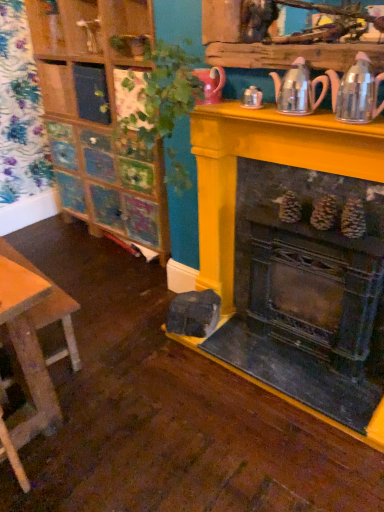
In order to click on shiny metallic teapot at upper right, acting as the 2th tea pot starting from the right in this screenshot , I will do `click(298, 89)`.

The width and height of the screenshot is (384, 512). What are the coordinates of `shiny metallic teapot at upper right, acting as the 2th tea pot starting from the right` in the screenshot? It's located at (298, 89).

Identify the location of tea pot in front of the rustic metal fireplace at center. Image resolution: width=384 pixels, height=512 pixels. pos(356,92).

Is rustic metal fireplace at center at the back of metallic silver tea pot at upper right, arranged as the first tea pot when viewed from the right?

No, metallic silver tea pot at upper right, arranged as the first tea pot when viewed from the right,'s orientation is not away from rustic metal fireplace at center.

Are metallic silver tea pot at upper right, arranged as the first tea pot when viewed from the right, and rustic metal fireplace at center beside each other?

metallic silver tea pot at upper right, arranged as the first tea pot when viewed from the right, and rustic metal fireplace at center are clearly separated.

Is metallic silver tea pot at upper right, which is the 2th tea pot in left-to-right order, taller than rustic metal fireplace at center?

In fact, metallic silver tea pot at upper right, which is the 2th tea pot in left-to-right order, may be shorter than rustic metal fireplace at center.

Looking at the image, does wooden stool at lower left seem bigger or smaller compared to shiny metallic teapot at upper right, acting as the 2th tea pot starting from the right?

Clearly, wooden stool at lower left is larger in size than shiny metallic teapot at upper right, acting as the 2th tea pot starting from the right.

Is wooden stool at lower left far away from shiny metallic teapot at upper right, acting as the 2th tea pot starting from the right?

That's right, there is a large distance between wooden stool at lower left and shiny metallic teapot at upper right, acting as the 2th tea pot starting from the right.

Does wooden stool at lower left turn towards shiny metallic teapot at upper right, which is the first tea pot in left-to-right order?

No, wooden stool at lower left is not oriented towards shiny metallic teapot at upper right, which is the first tea pot in left-to-right order.

From a real-world perspective, is wooden stool at lower left beneath green leafy plant at upper center?

Correct, in the physical world, wooden stool at lower left is lower than green leafy plant at upper center.

Is point (13, 284) positioned in front of point (168, 181)?

Yes.

Is wooden stool at lower left shorter than green leafy plant at upper center?

Correct, wooden stool at lower left is not as tall as green leafy plant at upper center.

Does wooden stool at lower left come in front of green leafy plant at upper center?

No, it is not.

Does shiny metallic teapot at upper right, acting as the 2th tea pot starting from the right, have a larger size compared to green leafy plant at upper center?

Incorrect, shiny metallic teapot at upper right, acting as the 2th tea pot starting from the right, is not larger than green leafy plant at upper center.

How many degrees apart are the facing directions of shiny metallic teapot at upper right, which is the first tea pot in left-to-right order, and green leafy plant at upper center?

2.83 degrees separate the facing orientations of shiny metallic teapot at upper right, which is the first tea pot in left-to-right order, and green leafy plant at upper center.

Can you see shiny metallic teapot at upper right, acting as the 2th tea pot starting from the right, touching green leafy plant at upper center?

They are not placed beside each other.

Is green leafy plant at upper center wider than rustic metal fireplace at center?

Yes.

Is green leafy plant at upper center positioned behind rustic metal fireplace at center?

Yes, green leafy plant at upper center is behind rustic metal fireplace at center.

Is point (132, 124) closer to viewer compared to point (296, 223)?

No, it is behind (296, 223).

From a real-world perspective, is green leafy plant at upper center physically above rustic metal fireplace at center?

Correct, in the physical world, green leafy plant at upper center is higher than rustic metal fireplace at center.

Between rustic metal fireplace at center and metallic silver tea pot at upper right, which is the 2th tea pot in left-to-right order, which one is positioned behind?

Positioned behind is rustic metal fireplace at center.

Considering the relative sizes of rustic metal fireplace at center and metallic silver tea pot at upper right, arranged as the first tea pot when viewed from the right, in the image provided, is rustic metal fireplace at center shorter than metallic silver tea pot at upper right, arranged as the first tea pot when viewed from the right,?

No.

Which is less distant, (x=281, y=327) or (x=357, y=98)?

Point (x=357, y=98)

Is rustic metal fireplace at center spatially inside metallic silver tea pot at upper right, which is the 2th tea pot in left-to-right order, or outside of it?

rustic metal fireplace at center lies outside metallic silver tea pot at upper right, which is the 2th tea pot in left-to-right order.

Is rustic metal fireplace at center with green leafy plant at upper center?

rustic metal fireplace at center and green leafy plant at upper center are not in contact.

From a real-world perspective, between rustic metal fireplace at center and green leafy plant at upper center, who is vertically lower?

From a 3D spatial view, rustic metal fireplace at center is below.

Could you tell me if rustic metal fireplace at center is turned towards green leafy plant at upper center?

Yes, rustic metal fireplace at center faces towards green leafy plant at upper center.

In order to click on the 1st tea pot above the rustic metal fireplace at center (from the image's perspective) in this screenshot , I will do `click(356, 92)`.

Locate an element on the screen. table that appears on the left of shiny metallic teapot at upper right, acting as the 2th tea pot starting from the right is located at coordinates (31, 350).

Considering their positions, is green leafy plant at upper center positioned further to wooden stool at lower left than shiny metallic teapot at upper right, acting as the 2th tea pot starting from the right?

shiny metallic teapot at upper right, acting as the 2th tea pot starting from the right, is further to wooden stool at lower left.

Looking at the image, which one is located closer to wooden stool at lower left, rustic metal fireplace at center or shiny metallic teapot at upper right, acting as the 2th tea pot starting from the right?

rustic metal fireplace at center.

Estimate the real-world distances between objects in this image. Which object is closer to wooden stool at lower left, green leafy plant at upper center or rustic metal fireplace at center?

rustic metal fireplace at center.

From the image, which object appears to be nearer to green leafy plant at upper center, rustic metal fireplace at center or wooden stool at lower left?

Based on the image, rustic metal fireplace at center appears to be nearer to green leafy plant at upper center.

Which object lies nearer to the anchor point rustic metal fireplace at center, green leafy plant at upper center or wooden stool at lower left?

green leafy plant at upper center is positioned closer to the anchor rustic metal fireplace at center.

From the picture: When comparing their distances from wooden stool at lower left, does rustic metal fireplace at center or metallic silver tea pot at upper right, which is the 2th tea pot in left-to-right order, seem further?

Based on the image, metallic silver tea pot at upper right, which is the 2th tea pot in left-to-right order, appears to be further to wooden stool at lower left.

Based on their spatial positions, is rustic metal fireplace at center or wooden stool at lower left further from shiny metallic teapot at upper right, which is the first tea pot in left-to-right order?

wooden stool at lower left lies further to shiny metallic teapot at upper right, which is the first tea pot in left-to-right order, than the other object.

Estimate the real-world distances between objects in this image. Which object is closer to shiny metallic teapot at upper right, which is the first tea pot in left-to-right order, green leafy plant at upper center or rustic metal fireplace at center?

Among the two, green leafy plant at upper center is located nearer to shiny metallic teapot at upper right, which is the first tea pot in left-to-right order.

Identify the location of tea pot situated between green leafy plant at upper center and metallic silver tea pot at upper right, which is the 2th tea pot in left-to-right order, from left to right. (298, 89).

The height and width of the screenshot is (512, 384). I want to click on plant between shiny metallic teapot at upper right, which is the first tea pot in left-to-right order, and rustic metal fireplace at center vertically, so click(x=164, y=92).

This screenshot has width=384, height=512. Find the location of `plant between wooden stool at lower left and metallic silver tea pot at upper right, which is the 2th tea pot in left-to-right order, from left to right`. plant between wooden stool at lower left and metallic silver tea pot at upper right, which is the 2th tea pot in left-to-right order, from left to right is located at coordinates (164, 92).

This screenshot has height=512, width=384. Identify the location of tea pot that lies between shiny metallic teapot at upper right, which is the first tea pot in left-to-right order, and rustic metal fireplace at center from top to bottom. (356, 92).